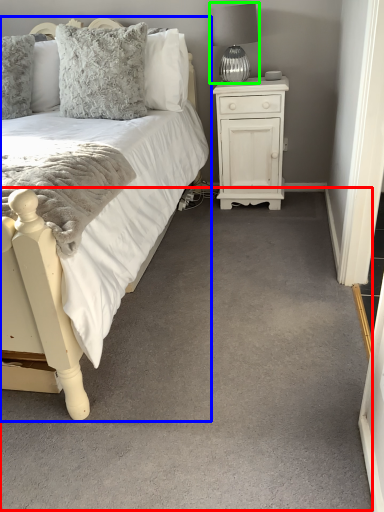
Question: Which object is the closest to the plain (highlighted by a red box)? Choose among these: bed (highlighted by a blue box) or table lamp (highlighted by a green box).

Choices:
 (A) bed
 (B) table lamp

Answer: (A)